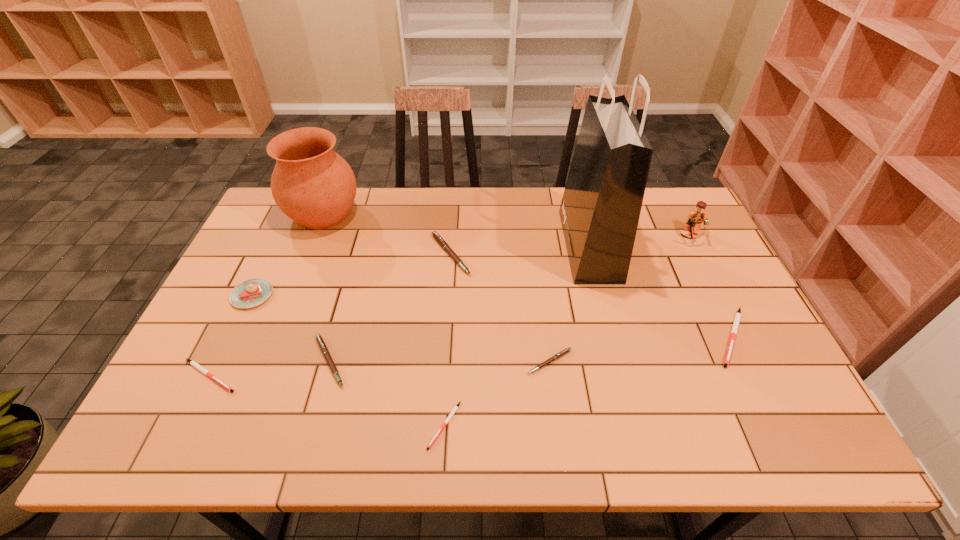
At what (x,y) coordinates should I click in order to perform the action: click on free space located 0.350m on the right of the pottery. Please return your answer as a coordinate pair (x, y). Looking at the image, I should click on (464, 213).

The height and width of the screenshot is (540, 960). In order to click on free spot located 0.290m holding a crossbow in the hands of the Lego in this screenshot , I will do `click(732, 319)`.

You are a GUI agent. You are given a task and a screenshot of the screen. Output one action in this format:
    pyautogui.click(x=<x>, y=<y>)
    Task: Click on the vacant space situated on the right of the fourth tallest object
    The image size is (960, 540).
    Given the screenshot: What is the action you would take?
    pyautogui.click(x=411, y=295)

Locate an element on the screen. This screenshot has height=540, width=960. free spot located 0.360m at the nib of the biggest pink pen is located at coordinates (588, 254).

This screenshot has width=960, height=540. In order to click on vacant region located 0.270m at the nib of the fifth pen from right to left in this screenshot , I will do `click(459, 361)`.

The height and width of the screenshot is (540, 960). I want to click on vacant space located on the clicker of the rightmost white pen, so click(x=760, y=395).

Locate an element on the screen. The height and width of the screenshot is (540, 960). vacant space located at the nib of the rightmost pink pen is located at coordinates (553, 394).

Find the location of a particular element. This screenshot has height=540, width=960. vacant space located 0.360m on the clicker of the leftmost white pen is located at coordinates (391, 376).

Locate an element on the screen. The height and width of the screenshot is (540, 960). shopping bag that is at the far edge is located at coordinates (600, 209).

You are a GUI agent. You are given a task and a screenshot of the screen. Output one action in this format:
    pyautogui.click(x=<x>, y=<y>)
    Task: Click on the pottery at the far edge
    The height and width of the screenshot is (540, 960).
    Given the screenshot: What is the action you would take?
    pyautogui.click(x=313, y=185)